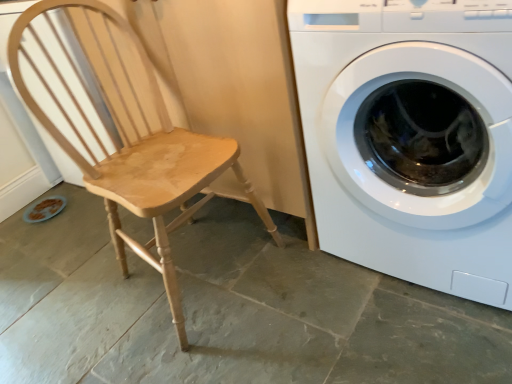
Question: Considering the relative positions of light wood chair at left and white glossy washing machine at right in the image provided, is light wood chair at left to the left or to the right of white glossy washing machine at right?

Choices:
 (A) right
 (B) left

Answer: (B)

Question: Considering the positions of light wood chair at left and white glossy washing machine at right in the image, is light wood chair at left bigger or smaller than white glossy washing machine at right?

Choices:
 (A) small
 (B) big

Answer: (A)

Question: From a real-world perspective, is light wood chair at left physically located above or below white glossy washing machine at right?

Choices:
 (A) below
 (B) above

Answer: (B)

Question: From the image's perspective, is white glossy washing machine at right positioned above or below light wood chair at left?

Choices:
 (A) above
 (B) below

Answer: (A)

Question: In the image, is white glossy washing machine at right positioned in front of or behind light wood chair at left?

Choices:
 (A) front
 (B) behind

Answer: (A)

Question: Visually, is white glossy washing machine at right positioned to the left or to the right of light wood chair at left?

Choices:
 (A) left
 (B) right

Answer: (B)

Question: From a real-world perspective, is white glossy washing machine at right above or below light wood chair at left?

Choices:
 (A) below
 (B) above

Answer: (A)